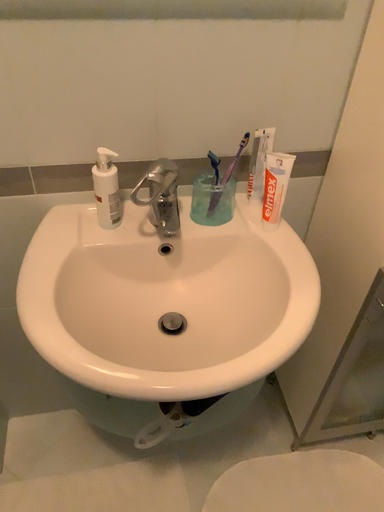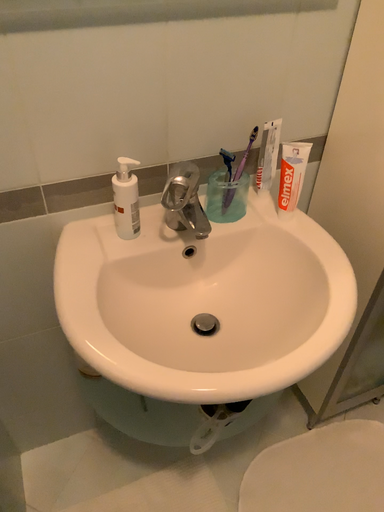
Question: How did the camera likely rotate when shooting the video?

Choices:
 (A) rotated left
 (B) rotated right

Answer: (B)